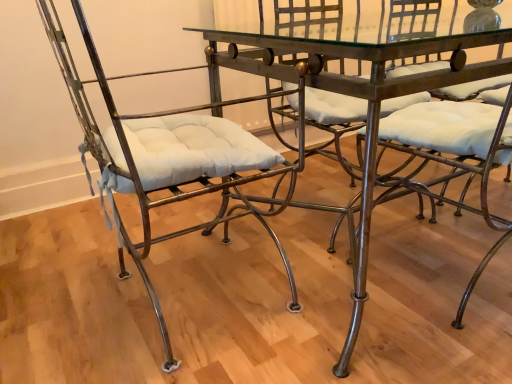
What is the approximate height of metallic glass table at center?

The height of metallic glass table at center is 29.66 inches.

This screenshot has height=384, width=512. Find the location of `metallic wrought iron chair at center, which ranks as the second chair in left-to-right order`. metallic wrought iron chair at center, which ranks as the second chair in left-to-right order is located at coordinates (456, 154).

From the image's perspective, is matte metal chair at left, the 2th chair when ordered from right to left, located beneath metallic glass table at center?

Correct, matte metal chair at left, the 2th chair when ordered from right to left, appears lower than metallic glass table at center in the image.

Looking at this image, is matte metal chair at left, the first chair in the left-to-right sequence, touching metallic glass table at center?

matte metal chair at left, the first chair in the left-to-right sequence, is not next to metallic glass table at center, and they're not touching.

Is point (142, 193) closer to camera compared to point (325, 52)?

No, it is behind (325, 52).

Which object is wider, matte metal chair at left, the 2th chair when ordered from right to left, or metallic glass table at center?

metallic glass table at center.

Is the depth of matte metal chair at left, the 2th chair when ordered from right to left, greater than that of metallic wrought iron chair at center, which ranks as the second chair in left-to-right order?

No, matte metal chair at left, the 2th chair when ordered from right to left, is in front of metallic wrought iron chair at center, which ranks as the second chair in left-to-right order.

From the image's perspective, does matte metal chair at left, the 2th chair when ordered from right to left, appear lower than metallic wrought iron chair at center, which is the first chair in right-to-left order?

Yes, from the image's perspective, matte metal chair at left, the 2th chair when ordered from right to left, is beneath metallic wrought iron chair at center, which is the first chair in right-to-left order.

Considering the sizes of matte metal chair at left, the first chair in the left-to-right sequence, and metallic wrought iron chair at center, which is the first chair in right-to-left order, in the image, is matte metal chair at left, the first chair in the left-to-right sequence, wider or thinner than metallic wrought iron chair at center, which is the first chair in right-to-left order,?

Considering their sizes, matte metal chair at left, the first chair in the left-to-right sequence, looks broader than metallic wrought iron chair at center, which is the first chair in right-to-left order.

From a real-world perspective, which is physically above, matte metal chair at left, the first chair in the left-to-right sequence, or metallic wrought iron chair at center, which is the first chair in right-to-left order?

From a 3D spatial view, matte metal chair at left, the first chair in the left-to-right sequence, is above.

Considering the sizes of objects metallic glass table at center and matte metal chair at left, the 2th chair when ordered from right to left, in the image provided, who is shorter, metallic glass table at center or matte metal chair at left, the 2th chair when ordered from right to left,?

metallic glass table at center is shorter.

Does point (377, 113) appear closer or farther from the camera than point (287, 306)?

Point (377, 113).

From the image's perspective, which is above, metallic glass table at center or matte metal chair at left, the 2th chair when ordered from right to left?

metallic glass table at center.

Between metallic glass table at center and matte metal chair at left, the 2th chair when ordered from right to left, which one has smaller size?

matte metal chair at left, the 2th chair when ordered from right to left.

Is metallic glass table at center looking in the opposite direction of metallic wrought iron chair at center, which ranks as the second chair in left-to-right order?

That's right, metallic glass table at center is facing away from metallic wrought iron chair at center, which ranks as the second chair in left-to-right order.

In the scene shown: Which point is more forward, (x=411, y=44) or (x=463, y=204)?

The point (x=411, y=44) is closer to the camera.

Is metallic glass table at center positioned beyond the bounds of metallic wrought iron chair at center, which is the first chair in right-to-left order?

Yes, metallic glass table at center is located beyond the bounds of metallic wrought iron chair at center, which is the first chair in right-to-left order.

Is metallic glass table at center shorter than metallic wrought iron chair at center, which is the first chair in right-to-left order?

Yes, metallic glass table at center is shorter than metallic wrought iron chair at center, which is the first chair in right-to-left order.

From a real-world perspective, between metallic wrought iron chair at center, which is the first chair in right-to-left order, and metallic glass table at center, who is vertically lower?

metallic glass table at center.

Which object is wider, metallic wrought iron chair at center, which is the first chair in right-to-left order, or metallic glass table at center?

Wider between the two is metallic glass table at center.

Are metallic wrought iron chair at center, which ranks as the second chair in left-to-right order, and metallic glass table at center located far from each other?

No.

Which is in front, point (475, 156) or point (175, 367)?

Point (475, 156)

Is metallic wrought iron chair at center, which is the first chair in right-to-left order, at the right side of matte metal chair at left, the 2th chair when ordered from right to left?

Yes.

From the image's perspective, is metallic wrought iron chair at center, which is the first chair in right-to-left order, beneath matte metal chair at left, the first chair in the left-to-right sequence?

No, from the image's perspective, metallic wrought iron chair at center, which is the first chair in right-to-left order, is not below matte metal chair at left, the first chair in the left-to-right sequence.

Could you measure the distance between metallic wrought iron chair at center, which is the first chair in right-to-left order, and matte metal chair at left, the first chair in the left-to-right sequence?

metallic wrought iron chair at center, which is the first chair in right-to-left order, is 51.88 centimeters away from matte metal chair at left, the first chair in the left-to-right sequence.

Where is `table that is on the right side of matte metal chair at left, the first chair in the left-to-right sequence`? table that is on the right side of matte metal chair at left, the first chair in the left-to-right sequence is located at coordinates (x=358, y=96).

Find the location of a particular element. chair above the matte metal chair at left, the 2th chair when ordered from right to left (from the image's perspective) is located at coordinates (456, 154).

Looking at the image, which one is located closer to matte metal chair at left, the first chair in the left-to-right sequence, metallic glass table at center or metallic wrought iron chair at center, which ranks as the second chair in left-to-right order?

metallic glass table at center lies closer to matte metal chair at left, the first chair in the left-to-right sequence, than the other object.

Considering their positions, is matte metal chair at left, the first chair in the left-to-right sequence, positioned further to metallic glass table at center than metallic wrought iron chair at center, which ranks as the second chair in left-to-right order?

Among the two, matte metal chair at left, the first chair in the left-to-right sequence, is located further to metallic glass table at center.

From the image, which object appears to be nearer to metallic wrought iron chair at center, which is the first chair in right-to-left order, matte metal chair at left, the 2th chair when ordered from right to left, or metallic glass table at center?

metallic glass table at center is positioned closer to the anchor metallic wrought iron chair at center, which is the first chair in right-to-left order.

Which object lies nearer to the anchor point metallic glass table at center, metallic wrought iron chair at center, which is the first chair in right-to-left order, or matte metal chair at left, the first chair in the left-to-right sequence?

metallic wrought iron chair at center, which is the first chair in right-to-left order.

From the image, which object appears to be nearer to matte metal chair at left, the 2th chair when ordered from right to left, metallic wrought iron chair at center, which ranks as the second chair in left-to-right order, or metallic glass table at center?

metallic glass table at center.

Looking at the image, which one is located further to metallic wrought iron chair at center, which ranks as the second chair in left-to-right order, metallic glass table at center or matte metal chair at left, the first chair in the left-to-right sequence?

Among the two, matte metal chair at left, the first chair in the left-to-right sequence, is located further to metallic wrought iron chair at center, which ranks as the second chair in left-to-right order.

You are a GUI agent. You are given a task and a screenshot of the screen. Output one action in this format:
    pyautogui.click(x=<x>, y=<y>)
    Task: Click on the chair between matte metal chair at left, the first chair in the left-to-right sequence, and metallic glass table at center from left to right
    Image resolution: width=512 pixels, height=384 pixels.
    Given the screenshot: What is the action you would take?
    pyautogui.click(x=456, y=154)